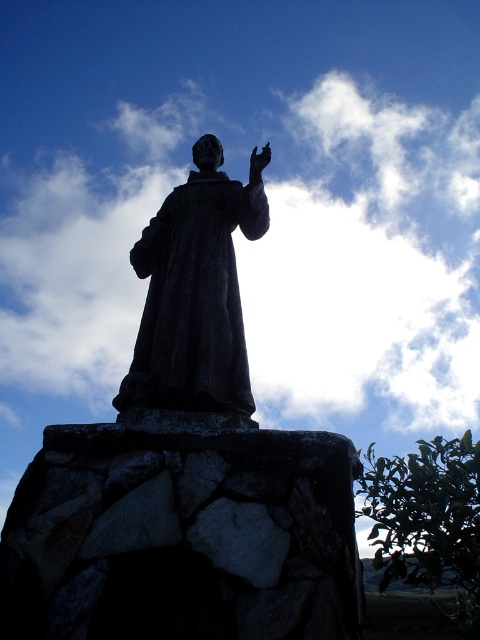
Does white fluffy cloud at upper center have a greater height compared to black matte robe at center?

Indeed, white fluffy cloud at upper center has a greater height compared to black matte robe at center.

Describe the element at coordinates (369, 266) in the screenshot. This screenshot has width=480, height=640. I see `white fluffy cloud at upper center` at that location.

Identify the location of white fluffy cloud at upper center. (369, 266).

Which of these two, black matte robe at center or matte black hand at upper center, stands shorter?

matte black hand at upper center is shorter.

Where is `black matte robe at center`? The image size is (480, 640). black matte robe at center is located at coordinates (193, 300).

Where is `black matte robe at center`? Image resolution: width=480 pixels, height=640 pixels. black matte robe at center is located at coordinates tap(193, 300).

Is black matte robe at center wider than matte stone statue at upper center?

Yes.

Describe the element at coordinates (193, 300) in the screenshot. I see `black matte robe at center` at that location.

This screenshot has width=480, height=640. In order to click on black matte robe at center in this screenshot , I will do `click(193, 300)`.